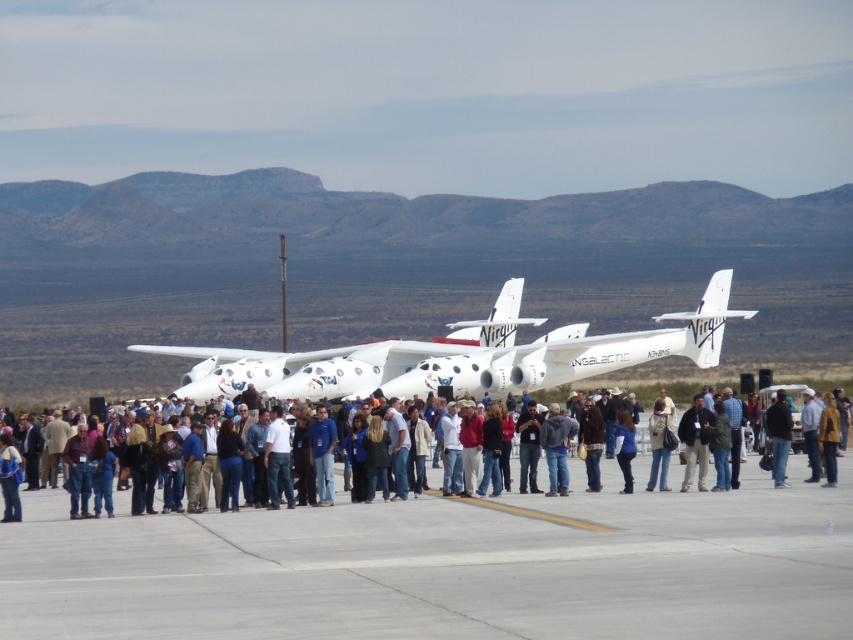
Can you confirm if white casual clothing at center is wider than black leather jacket at center?

Yes.

Can you confirm if white casual clothing at center is positioned above black leather jacket at center?

Incorrect, white casual clothing at center is not positioned above black leather jacket at center.

Who is more distant from viewer, (x=718, y=508) or (x=785, y=438)?

The point (x=785, y=438) is more distant.

Where is `white casual clothing at center`? white casual clothing at center is located at coordinates (606, 506).

Is point (618, 605) in front of point (276, 380)?

That is True.

This screenshot has height=640, width=853. Identify the location of gray concrete tarmac at center. coord(445,566).

Can you confirm if gray concrete tarmac at center is taller than black leather jacket at center?

No.

Who is positioned more to the left, gray concrete tarmac at center or black leather jacket at center?

From the viewer's perspective, gray concrete tarmac at center appears more on the left side.

Identify the location of gray concrete tarmac at center. (445, 566).